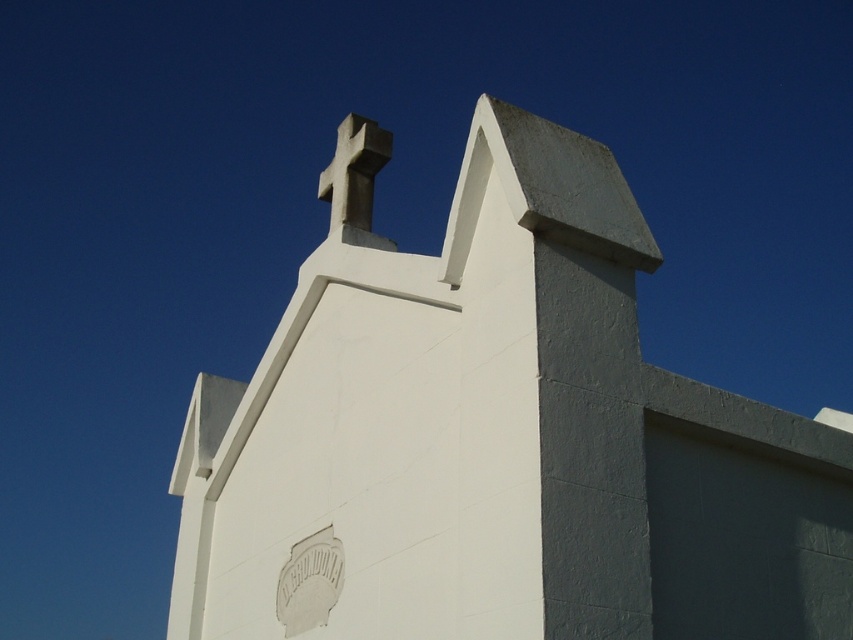
You are a maintenance worker needing to reach the white stone cross at upper center from the white smooth stone church at center. Given that your ladder can extend up to 20 feet, will it be sufficient to reach the cross?

The distance between the white smooth stone church at center and the white stone cross at upper center is 19.21 feet, so yes, the ladder can reach the cross since it extends up to 20 feet.

You are an architect examining the building. You notice the white smooth stone church at center and the white stone cross at upper center. Which object is larger in size?

The white smooth stone church at center is smaller in size compared to the white stone cross at upper center according to the description.